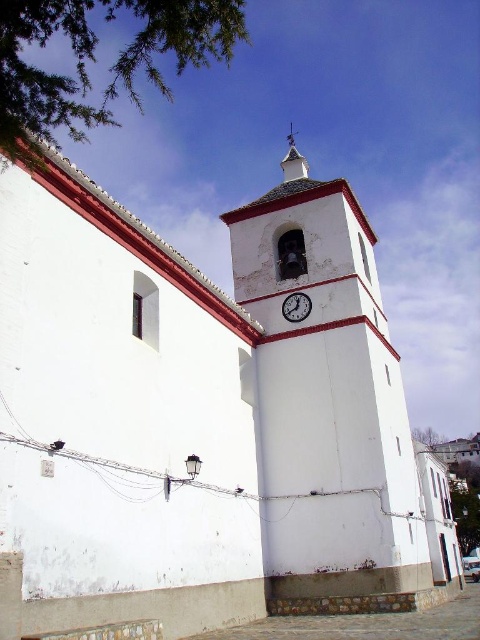
You are standing in front of the church and want to take a photo of both the white painted brick clock tower at center and the white wood spire at upper center. Which object should you focus on first if you want to capture both in the same frame without moving the camera?

The white painted brick clock tower at center is wider than the white wood spire at upper center, so you should focus on the white painted brick clock tower at center first to ensure both fit in the frame.

Based on the photo, you are an architect designing a model of the church. You need to ensure the white wood spire at upper center and the white glossy clock at upper center are proportionally accurate. Which object should have a wider base in your model?

The white wood spire at upper center should have a wider base in the model since its width is larger than the white glossy clock at upper center according to the description.